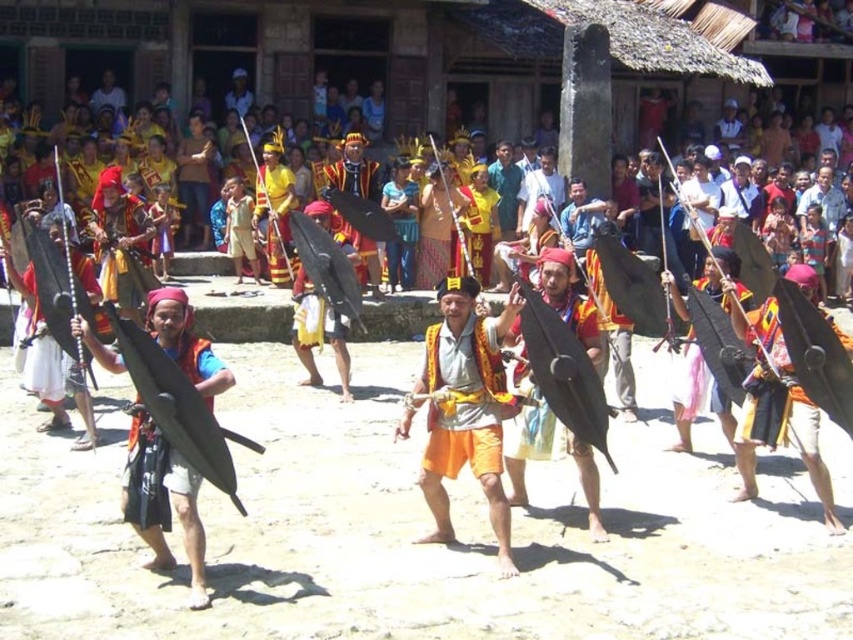
Question: Does orange fabric at center have a smaller size compared to matte black shield at center?

Choices:
 (A) yes
 (B) no

Answer: (A)

Question: Does orange fabric at center have a greater width compared to matte black shield at center?

Choices:
 (A) yes
 (B) no

Answer: (B)

Question: Which object is closer to the camera taking this photo?

Choices:
 (A) matte black shield at center
 (B) orange fabric at center

Answer: (B)

Question: Can you confirm if orange fabric at center is positioned below matte black shield at center?

Choices:
 (A) no
 (B) yes

Answer: (B)

Question: Which point is closer to the camera?

Choices:
 (A) matte black shield at center
 (B) orange fabric at center

Answer: (B)

Question: Among these objects, which one is farthest from the camera?

Choices:
 (A) matte black shield at center
 (B) orange fabric at center

Answer: (A)